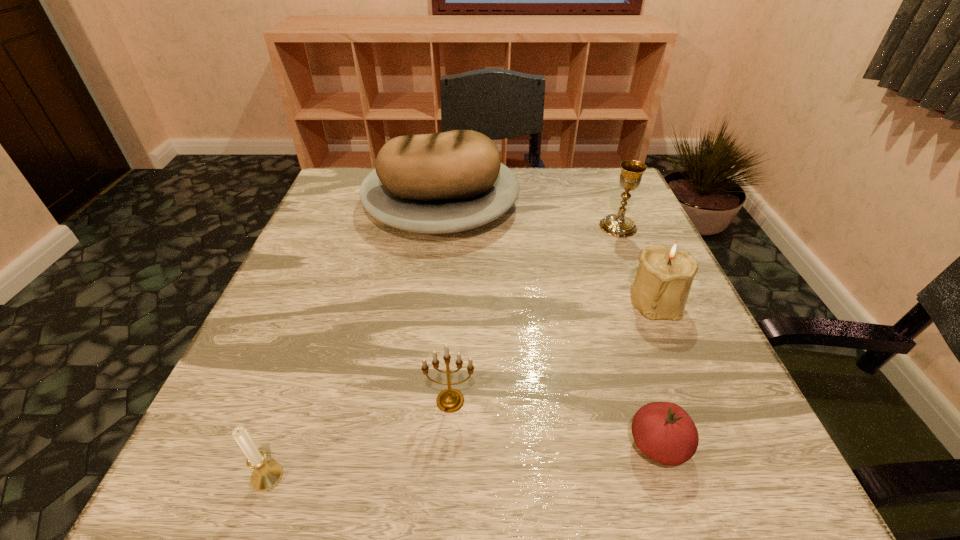
At what (x,y) coordinates should I click in order to perform the action: click on candle_holder present at the right edge. Please return your answer as a coordinate pair (x, y). Looking at the image, I should click on (665, 274).

The height and width of the screenshot is (540, 960). What are the coordinates of `tomato that is positioned at the right edge` in the screenshot? It's located at (663, 431).

This screenshot has width=960, height=540. What are the coordinates of `object that is at the far left corner` in the screenshot? It's located at (454, 181).

At what (x,y) coordinates should I click in order to perform the action: click on object that is at the near left corner. Please return your answer as a coordinate pair (x, y). Looking at the image, I should click on (267, 474).

Find the location of a particular element. object that is at the near right corner is located at coordinates (663, 431).

The width and height of the screenshot is (960, 540). Find the location of `blank area at the far edge`. blank area at the far edge is located at coordinates (571, 200).

In the image, there is a desktop. In order to click on vacant space at the near edge in this screenshot , I will do `click(509, 514)`.

In the image, there is a desktop. Identify the location of vacant space at the left edge. (312, 403).

Where is `vacant space at the right edge of the desktop`? The height and width of the screenshot is (540, 960). vacant space at the right edge of the desktop is located at coordinates (599, 237).

Where is `vacant region at the far left corner`? The width and height of the screenshot is (960, 540). vacant region at the far left corner is located at coordinates (342, 177).